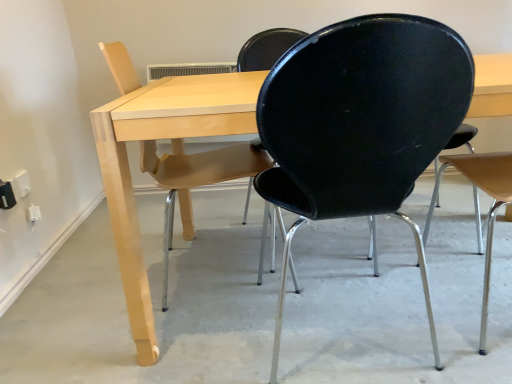
The width and height of the screenshot is (512, 384). I want to click on vacant area situated to the left side of black plastic chair at center, arranged as the second chair when viewed from the right, so click(x=203, y=345).